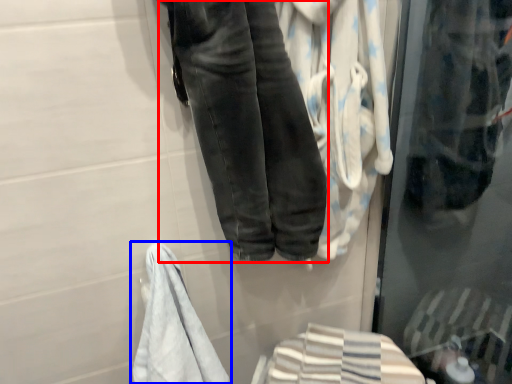
Question: Which object is closer to the camera taking this photo, trousers (highlighted by a red box) or towel (highlighted by a blue box)?

Choices:
 (A) trousers
 (B) towel

Answer: (A)